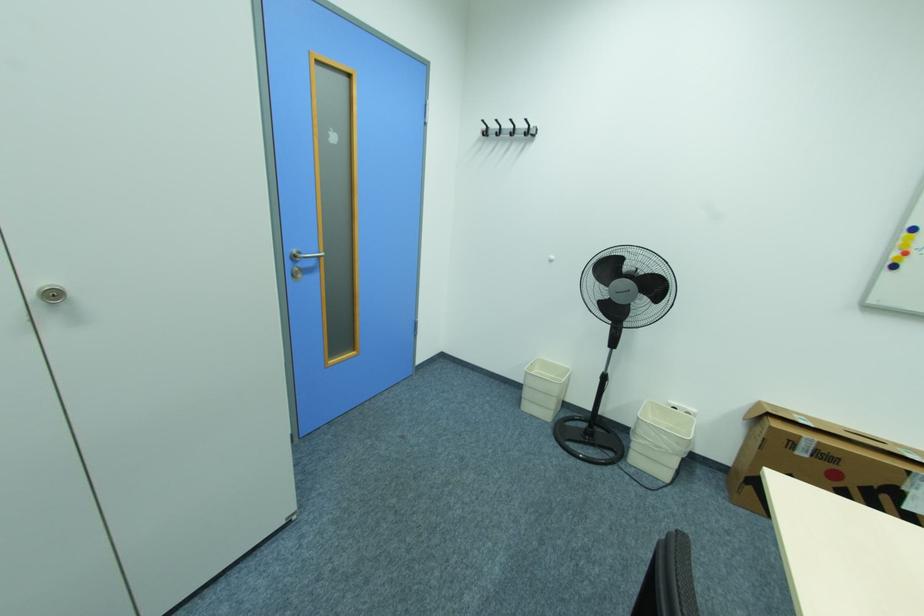
The location [902,268] corresponds to which object?

This point indicates the circular whiteboard magnet.